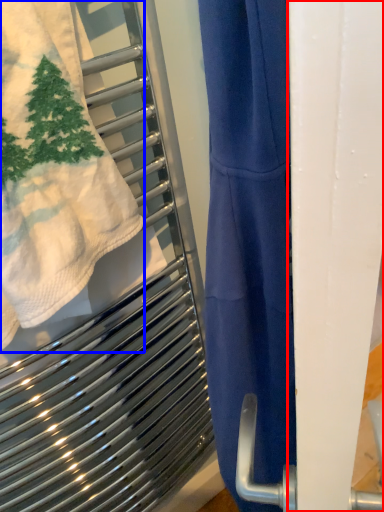
Question: Which object appears closest to the camera in this image, screen door (highlighted by a red box) or towel (highlighted by a blue box)?

Choices:
 (A) screen door
 (B) towel

Answer: (A)